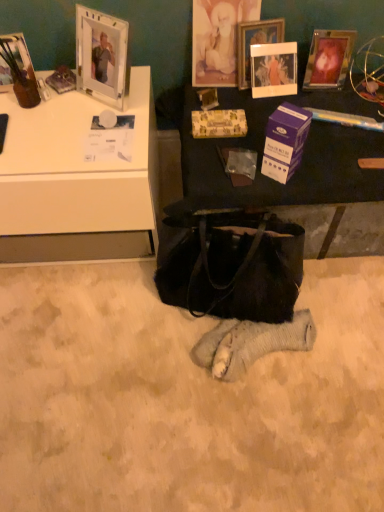
Where is `vacant space behind gold-patterned paper at center`? The height and width of the screenshot is (512, 384). vacant space behind gold-patterned paper at center is located at coordinates (221, 95).